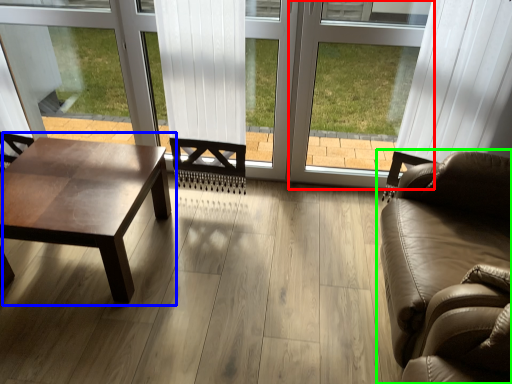
Question: Estimate the real-world distances between objects in this image. Which object is farther from window frame (highlighted by a red box), coffee table (highlighted by a blue box) or studio couch (highlighted by a green box)?

Choices:
 (A) coffee table
 (B) studio couch

Answer: (A)